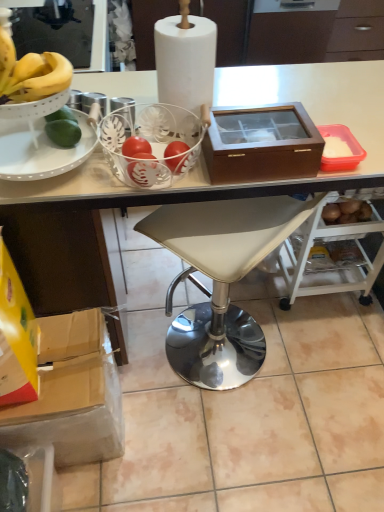
Find the location of a particular element. The image size is (384, 512). free space above cardboard box at lower left (from a real-world perspective) is located at coordinates (63, 369).